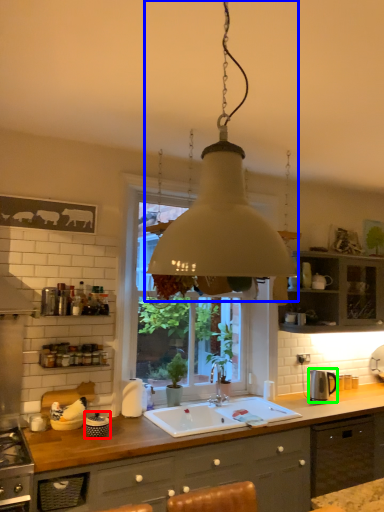
Question: Estimate the real-world distances between objects in this image. Which object is closer to appliance (highlighted by a red box), lamp (highlighted by a blue box) or appliance (highlighted by a green box)?

Choices:
 (A) lamp
 (B) appliance

Answer: (A)